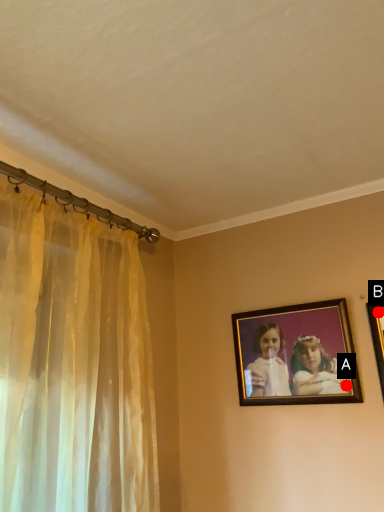
Question: Two points are circled on the image, labeled by A and B beside each circle. Which of the following is the closest to the observer?

Choices:
 (A) A is closer
 (B) B is closer

Answer: (A)